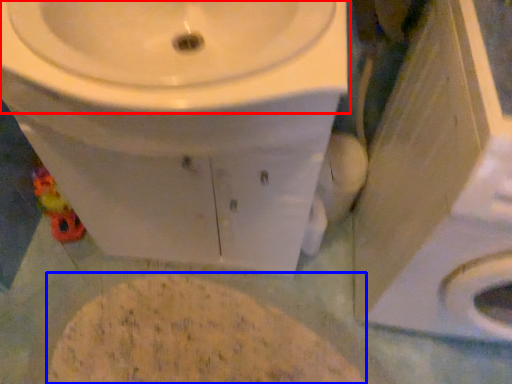
Question: Which point is closer to the camera, sink (highlighted by a red box) or flour (highlighted by a blue box)?

Choices:
 (A) sink
 (B) flour

Answer: (A)